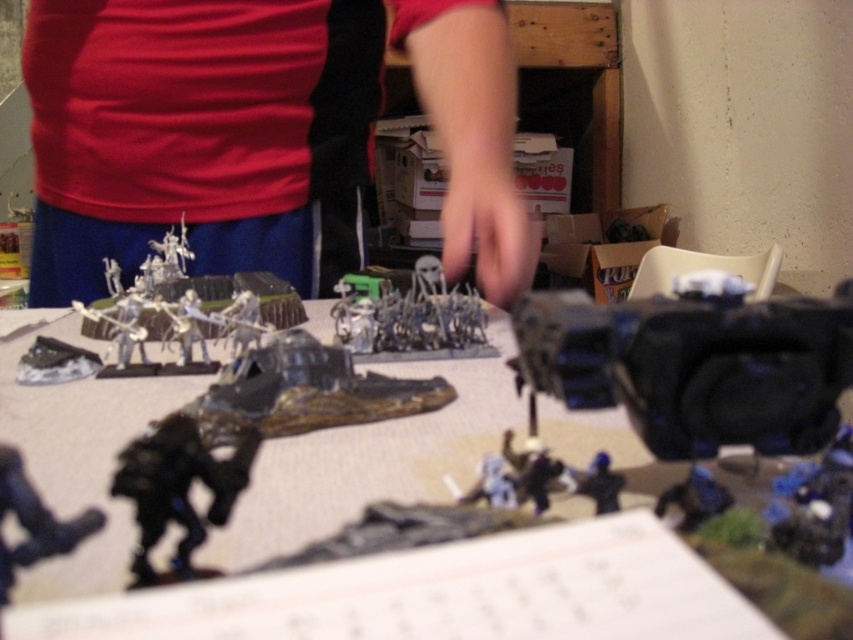
Question: Can you confirm if white plastic miniature soldiers at center is positioned to the right of shiny black figure at lower left?

Choices:
 (A) no
 (B) yes

Answer: (A)

Question: Which object appears closest to the camera in this image?

Choices:
 (A) blue plastic toy at center
 (B) black plastic tank at center
 (C) metallic gray terrain at center

Answer: (C)

Question: Which of the following is the farthest from the observer?

Choices:
 (A) black plastic tank at center
 (B) red fabric shirt at upper center
 (C) metallic gray terrain at center

Answer: (B)

Question: Which point appears farthest from the camera in this image?

Choices:
 (A) (264, 211)
 (B) (3, 586)
 (C) (659, 353)
 (D) (230, 428)

Answer: (A)

Question: Observing the image, what is the correct spatial positioning of black plastic tank at center in reference to white plastic miniature soldiers at center?

Choices:
 (A) right
 (B) left

Answer: (A)

Question: Considering the relative positions of red fabric shirt at upper center and black matte figure at center in the image provided, where is red fabric shirt at upper center located with respect to black matte figure at center?

Choices:
 (A) right
 (B) left

Answer: (B)